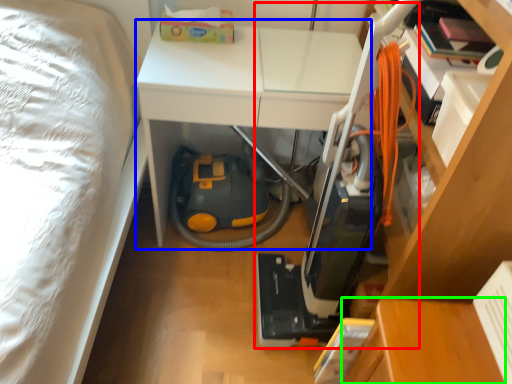
Question: Based on their relative distances, which object is nearer to vacuum (highlighted by a red box)? Choose from table (highlighted by a blue box) and table (highlighted by a green box).

Choices:
 (A) table
 (B) table

Answer: (B)